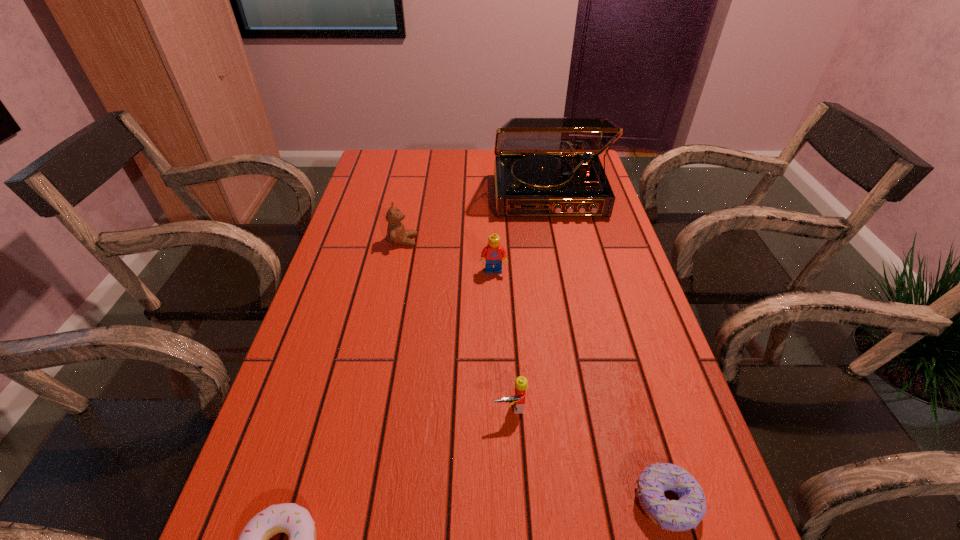
Find the location of `blank area in the image that satisfies the following two spatial constraints: 1. on the face of the right doughnut; 2. on the right side of the taller Lego`. blank area in the image that satisfies the following two spatial constraints: 1. on the face of the right doughnut; 2. on the right side of the taller Lego is located at coordinates (501, 502).

The height and width of the screenshot is (540, 960). I want to click on free location that satisfies the following two spatial constraints: 1. on the face of the second farthest object; 2. on the right side of the right doughnut, so click(x=350, y=502).